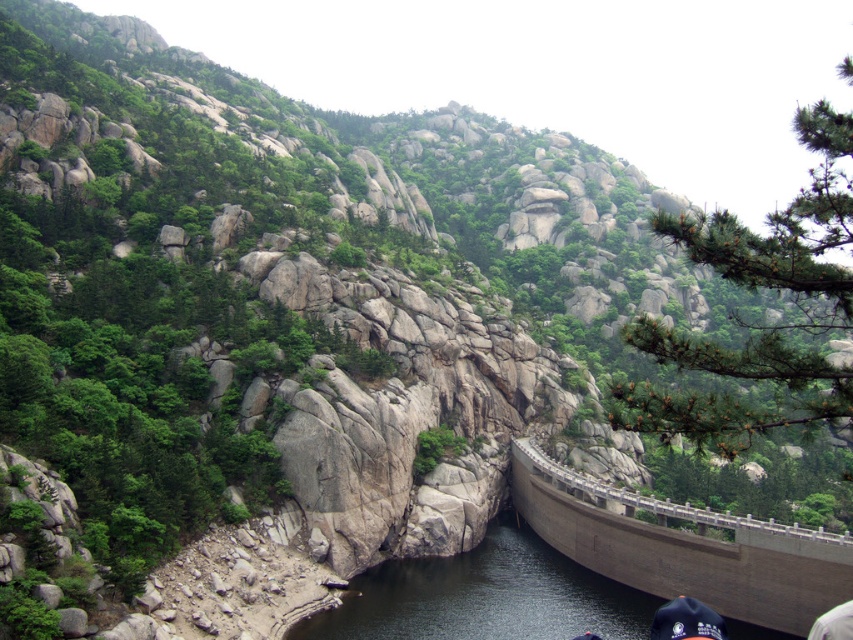
Question: Can you confirm if gray concrete dam at center is positioned above dark gray concrete river at center?

Choices:
 (A) no
 (B) yes

Answer: (B)

Question: Is gray concrete dam at center below dark gray concrete river at center?

Choices:
 (A) no
 (B) yes

Answer: (A)

Question: Among these points, which one is farthest from the camera?

Choices:
 (A) (521, 481)
 (B) (546, 596)

Answer: (A)

Question: Is gray concrete dam at center to the left of dark gray concrete river at center from the viewer's perspective?

Choices:
 (A) no
 (B) yes

Answer: (A)

Question: Which object is farther from the camera taking this photo?

Choices:
 (A) gray concrete dam at center
 (B) dark gray concrete river at center

Answer: (A)